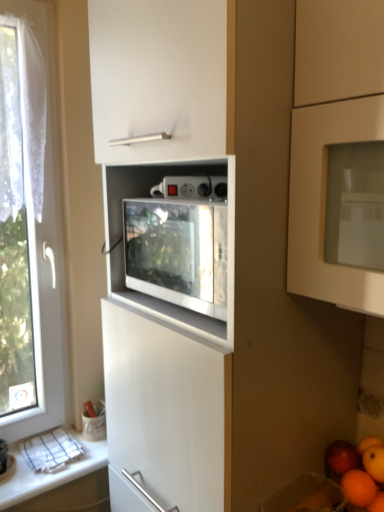
Question: Do you think red matte apple at lower right is within transparent fabric at left, or outside of it?

Choices:
 (A) outside
 (B) inside

Answer: (A)

Question: From the image's perspective, is red matte apple at lower right located above or below transparent fabric at left?

Choices:
 (A) below
 (B) above

Answer: (A)

Question: Which of these objects is positioned farthest from the transparent fabric at left?

Choices:
 (A) red matte apple at lower right
 (B) white glossy countertop at lower left
 (C) orange matte at lower right, which is the first orange from bottom to top
 (D) smooth orange at lower right
 (E) orange matte at lower right, positioned as the second orange in bottom-to-top order

Answer: (C)

Question: Estimate the real-world distances between objects in this image. Which object is farther from the white glossy countertop at lower left?

Choices:
 (A) smooth orange at lower right
 (B) transparent fabric at left
 (C) red matte apple at lower right
 (D) orange matte at lower right, positioned as the second orange in bottom-to-top order
 (E) orange matte at lower right, which is the first orange from bottom to top

Answer: (E)